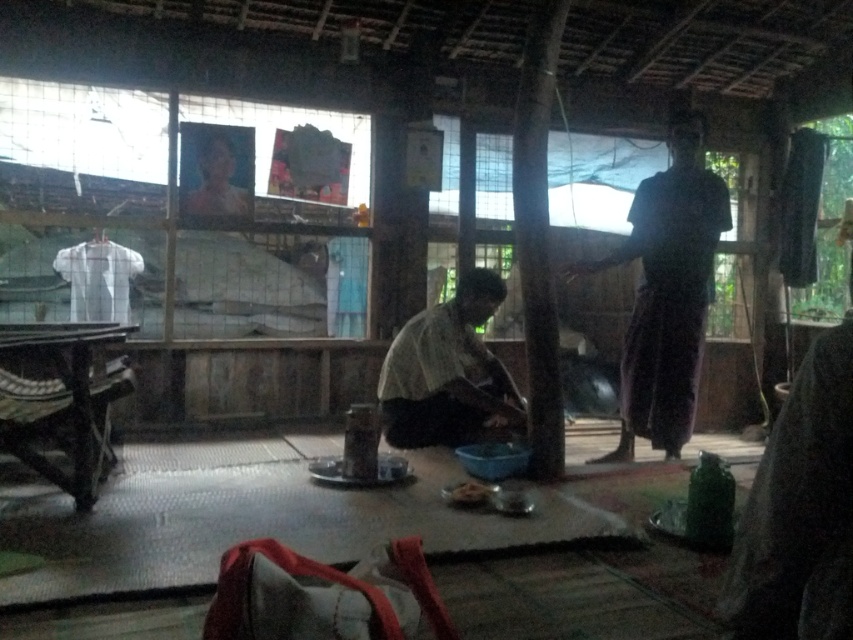
Question: Is dark brown fabric at right to the left of matte white shirt at center from the viewer's perspective?

Choices:
 (A) no
 (B) yes

Answer: (A)

Question: Which of the following is the farthest from the observer?

Choices:
 (A) matte white shirt at center
 (B) dark brown fabric at right

Answer: (B)

Question: Does dark brown fabric at right lie in front of matte white shirt at center?

Choices:
 (A) yes
 (B) no

Answer: (B)

Question: Which of the following is the closest to the observer?

Choices:
 (A) (677, 364)
 (B) (490, 385)

Answer: (A)

Question: In this image, where is dark brown fabric at right located relative to matte white shirt at center?

Choices:
 (A) right
 (B) left

Answer: (A)

Question: Which object appears closest to the camera in this image?

Choices:
 (A) dark brown fabric at right
 (B) matte white shirt at center

Answer: (B)